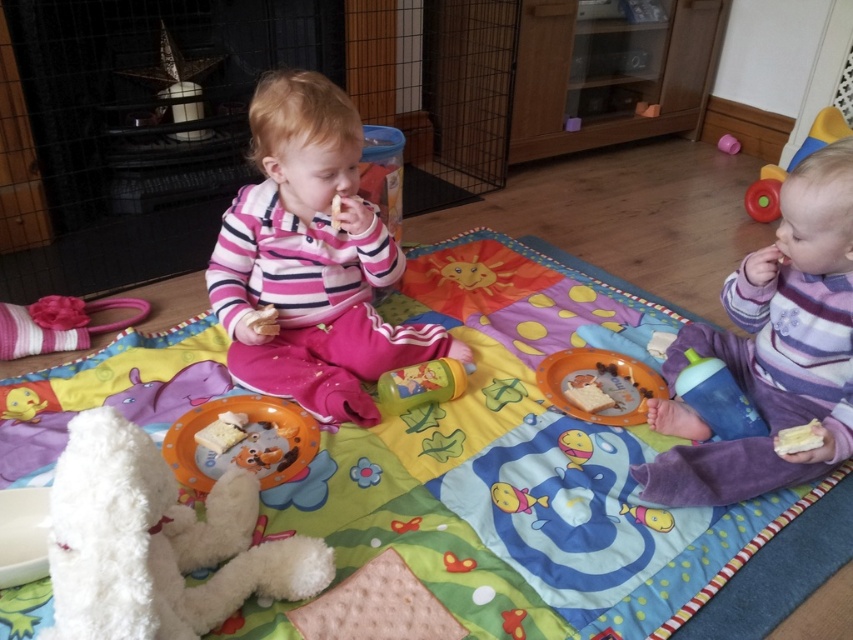
Question: Which object is closer to the camera taking this photo?

Choices:
 (A) rubberized red ball at upper right
 (B) white fluffy stuffed animal at lower left
 (C) pink fleece sweater at center

Answer: (B)

Question: Which point is farther to the camera?

Choices:
 (A) (384, 436)
 (B) (756, 196)
 (C) (815, 432)

Answer: (B)

Question: Does purple fleece toddler at lower right have a larger size compared to matte pink cup at upper right?

Choices:
 (A) no
 (B) yes

Answer: (B)

Question: Can you confirm if pink fleece sweater at center is bigger than matte pink cup at upper right?

Choices:
 (A) yes
 (B) no

Answer: (A)

Question: Is purple fleece toddler at lower right further to camera compared to white fluffy stuffed animal at lower left?

Choices:
 (A) yes
 (B) no

Answer: (A)

Question: Considering the real-world distances, which object is farthest from the matte pink cup at upper right?

Choices:
 (A) purple fleece toddler at lower right
 (B) pink fleece sweater at center
 (C) rubberized red ball at upper right

Answer: (B)